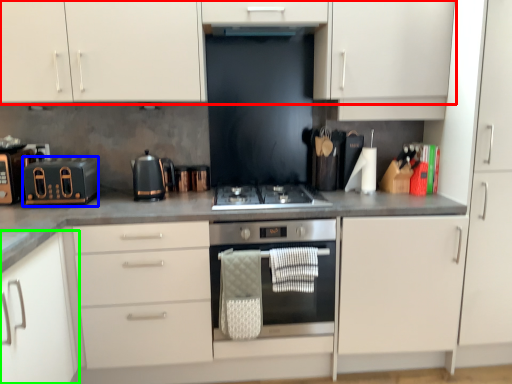
Question: Which object is the farthest from cabinetry (highlighted by a red box)? Choose among these: kitchen appliance (highlighted by a blue box) or cabinetry (highlighted by a green box).

Choices:
 (A) kitchen appliance
 (B) cabinetry

Answer: (B)